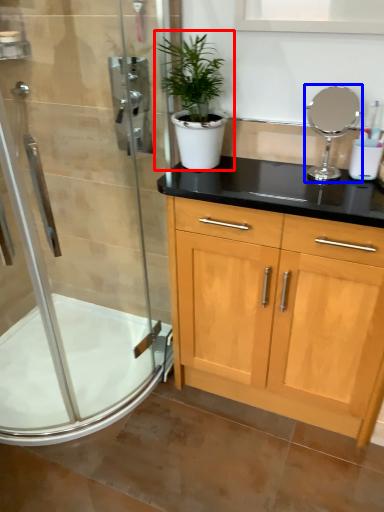
Question: Which of the following is the farthest to the observer, houseplant (highlighted by a red box) or mirror (highlighted by a blue box)?

Choices:
 (A) houseplant
 (B) mirror

Answer: (B)